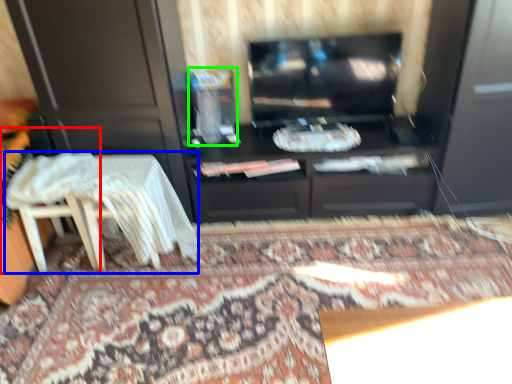
Question: Which object is the closest to the chair (highlighted by a red box)? Choose among these: table (highlighted by a blue box) or appliance (highlighted by a green box).

Choices:
 (A) table
 (B) appliance

Answer: (A)